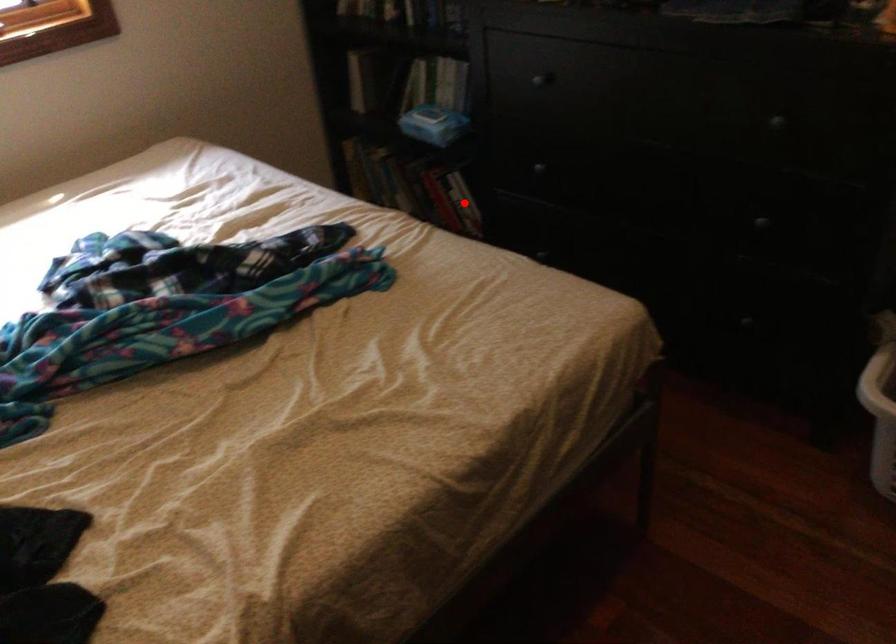
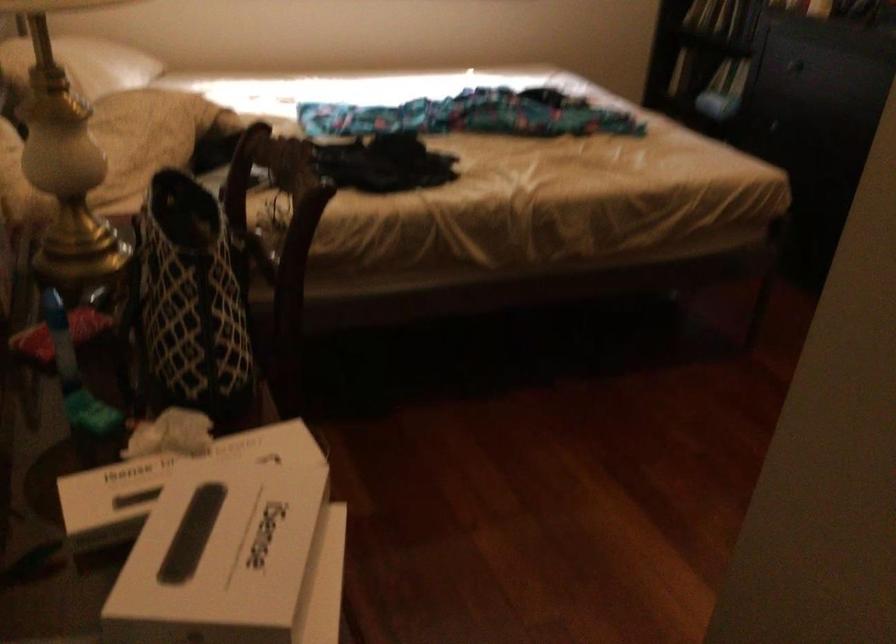
Question: I am providing you with two images of the same scene from different viewpoints. A red point is marked on the first image. Can you still see the location of the red point in image 2?

Choices:
 (A) Yes
 (B) No

Answer: (B)